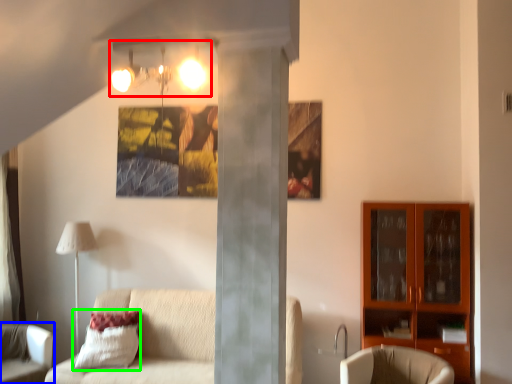
Question: Which is farther away from light fixture (highlighted by a red box)? chair (highlighted by a blue box) or pillow (highlighted by a green box)?

Choices:
 (A) chair
 (B) pillow

Answer: (A)